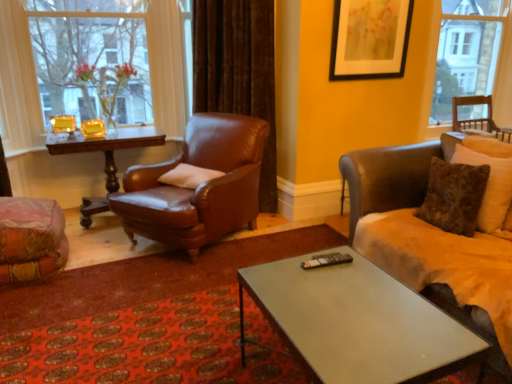
The image size is (512, 384). I want to click on wooden polished table at left, so click(x=106, y=147).

In order to face clear glass vase at upper left, the second window in the right-to-left sequence, should I rotate leftwards or rightwards?

To face it directly, rotate left by 20.698 degrees.

Image resolution: width=512 pixels, height=384 pixels. I want to click on velvet orange chair at lower left, positioned as the 1th chair in left-to-right order, so click(x=29, y=234).

Locate an element on the screen. wooden chair at right, acting as the 2th window starting from the left is located at coordinates (474, 56).

In order to click on brown velvet curtain at upper center in this screenshot , I will do `click(238, 71)`.

Locate an element on the screen. This screenshot has height=384, width=512. wooden polished table at left is located at coordinates (106, 147).

Which of these two, metallic gray coffee table at center or clear glass vase at upper left, arranged as the first window when viewed from the left, stands shorter?

Standing shorter between the two is metallic gray coffee table at center.

Is metallic gray coffee table at center positioned in front of clear glass vase at upper left, arranged as the first window when viewed from the left?

Yes, metallic gray coffee table at center is closer to the camera.

Is metallic gray coffee table at center far away from clear glass vase at upper left, the second window in the right-to-left sequence?

Indeed, metallic gray coffee table at center is not near clear glass vase at upper left, the second window in the right-to-left sequence.

In the scene shown: Could you tell me if white soft pillow at center is turned towards metallic gray coffee table at center?

No, white soft pillow at center is not aimed at metallic gray coffee table at center.

From a real-world perspective, relative to metallic gray coffee table at center, is white soft pillow at center vertically above or below?

white soft pillow at center is situated higher than metallic gray coffee table at center in the real world.

Between white soft pillow at center and metallic gray coffee table at center, which one has larger size?

Bigger between the two is metallic gray coffee table at center.

What are the coordinates of `coffee table that appears below the white soft pillow at center (from a real-world perspective)` in the screenshot? It's located at (357, 323).

From the image's perspective, would you say matte black picture frame at upper center is shown under white soft pillow at center?

Incorrect, from the image's perspective, matte black picture frame at upper center is higher than white soft pillow at center.

Does matte black picture frame at upper center contain white soft pillow at center?

Actually, white soft pillow at center is outside matte black picture frame at upper center.

Considering the positions of points (343, 59) and (193, 178), is point (343, 59) farther from camera compared to point (193, 178)?

Yes, point (343, 59) is farther from viewer.

This screenshot has width=512, height=384. In order to click on picture frame above the white soft pillow at center (from a real-world perspective) in this screenshot , I will do `click(369, 39)`.

Is brown leather couch at right, the 2th chair viewed from the right, oriented away from clear glass vase at upper left, arranged as the first window when viewed from the left?

brown leather couch at right, the 2th chair viewed from the right, is not turned away from clear glass vase at upper left, arranged as the first window when viewed from the left.

Could clear glass vase at upper left, arranged as the first window when viewed from the left, be considered to be inside brown leather couch at right, the 2th chair viewed from the right?

Definitely not — clear glass vase at upper left, arranged as the first window when viewed from the left, is not inside brown leather couch at right, the 2th chair viewed from the right.

From the image's perspective, is brown leather couch at right, which is counted as the third chair, starting from the left, on top of clear glass vase at upper left, the second window in the right-to-left sequence?

No, from the image's perspective, brown leather couch at right, which is counted as the third chair, starting from the left, is not over clear glass vase at upper left, the second window in the right-to-left sequence.

Considering the sizes of objects brown leather couch at right, which is counted as the third chair, starting from the left, and clear glass vase at upper left, the second window in the right-to-left sequence, in the image provided, who is bigger, brown leather couch at right, which is counted as the third chair, starting from the left, or clear glass vase at upper left, the second window in the right-to-left sequence,?

With larger size is brown leather couch at right, which is counted as the third chair, starting from the left.

Is point (158, 144) closer to viewer compared to point (375, 254)?

No, (158, 144) is behind (375, 254).

From the image's perspective, relative to brown leather couch at right, the 2th chair viewed from the right, is wooden polished table at left above or below?

Clearly, from the image's perspective, wooden polished table at left is above brown leather couch at right, the 2th chair viewed from the right.

From a real-world perspective, does wooden polished table at left sit lower than brown leather couch at right, which is counted as the third chair, starting from the left?

Correct, in the physical world, wooden polished table at left is lower than brown leather couch at right, which is counted as the third chair, starting from the left.

Is wooden polished table at left located outside brown leather couch at right, which is counted as the third chair, starting from the left?

Yes, wooden polished table at left is not within brown leather couch at right, which is counted as the third chair, starting from the left.

Considering the points (268, 19) and (509, 231), which point is in front, point (268, 19) or point (509, 231)?

Point (509, 231)

Is brown velvet curtain at upper center not inside brown leather couch at right, which is counted as the third chair, starting from the left?

Yes, brown velvet curtain at upper center is outside of brown leather couch at right, which is counted as the third chair, starting from the left.

Is the position of brown velvet curtain at upper center less distant than that of brown leather couch at right, the 2th chair viewed from the right?

No, brown velvet curtain at upper center is further to the viewer.

Does brown velvet curtain at upper center touch brown leather couch at right, which is counted as the third chair, starting from the left?

There is a gap between brown velvet curtain at upper center and brown leather couch at right, which is counted as the third chair, starting from the left.

Does wooden chair at right, acting as the first window starting from the right, lie in front of wooden polished table at left?

No.

Can you confirm if wooden chair at right, acting as the first window starting from the right, is smaller than wooden polished table at left?

Indeed, wooden chair at right, acting as the first window starting from the right, has a smaller size compared to wooden polished table at left.

Which is correct: wooden chair at right, acting as the first window starting from the right, is inside wooden polished table at left, or outside of it?

wooden chair at right, acting as the first window starting from the right, is outside wooden polished table at left.

Is wooden chair at right, acting as the first window starting from the right, at the right side of wooden polished table at left?

Correct, you'll find wooden chair at right, acting as the first window starting from the right, to the right of wooden polished table at left.

Locate an element on the screen. the 1st window behind the metallic gray coffee table at center is located at coordinates (18, 81).

Identify the location of pillow that appears above the metallic gray coffee table at center (from a real-world perspective). (189, 176).

Looking at the image, which one is located closer to velvet orange chair at lower left, positioned as the 1th chair in left-to-right order, black plastic remote control at center or brown leather chair at center, which ranks as the second chair in left-to-right order?

Among the two, brown leather chair at center, which ranks as the second chair in left-to-right order, is located nearer to velvet orange chair at lower left, positioned as the 1th chair in left-to-right order.

From the image, which object appears to be nearer to velvet orange chair at lower left, positioned as the 1th chair in left-to-right order, brown leather couch at right, which is counted as the third chair, starting from the left, or wooden chair at right, positioned as the fourth chair in left-to-right order?

brown leather couch at right, which is counted as the third chair, starting from the left, is positioned closer to the anchor velvet orange chair at lower left, positioned as the 1th chair in left-to-right order.

Considering their positions, is brown leather chair at center, which ranks as the second chair in left-to-right order, positioned closer to velvet orange chair at lower left, the 4th chair when ordered from right to left, than matte black picture frame at upper center?

Among the two, brown leather chair at center, which ranks as the second chair in left-to-right order, is located nearer to velvet orange chair at lower left, the 4th chair when ordered from right to left.

Based on their spatial positions, is clear glass vase at upper left, the second window in the right-to-left sequence, or white soft pillow at center further from brown leather chair at center, which ranks as the second chair in left-to-right order?

clear glass vase at upper left, the second window in the right-to-left sequence.

Considering their positions, is velvet orange chair at lower left, positioned as the 1th chair in left-to-right order, positioned closer to brown leather couch at right, which is counted as the third chair, starting from the left, than clear glass vase at upper left, arranged as the first window when viewed from the left?

velvet orange chair at lower left, positioned as the 1th chair in left-to-right order, is closer to brown leather couch at right, which is counted as the third chair, starting from the left.

Looking at the image, which one is located further to brown leather chair at center, which ranks as the second chair in left-to-right order, white soft pillow at center or wooden chair at right, acting as the 2th window starting from the left?

Based on the image, wooden chair at right, acting as the 2th window starting from the left, appears to be further to brown leather chair at center, which ranks as the second chair in left-to-right order.

Which object lies nearer to the anchor point brown leather chair at center, the 3th chair viewed from the right, matte black picture frame at upper center or metallic gray coffee table at center?

matte black picture frame at upper center is closer to brown leather chair at center, the 3th chair viewed from the right.

When comparing their distances from metallic gray coffee table at center, does wooden chair at right, positioned as the fourth chair in left-to-right order, or matte black picture frame at upper center seem closer?

Based on the image, matte black picture frame at upper center appears to be nearer to metallic gray coffee table at center.

Find the location of `chair between velvet orange chair at lower left, positioned as the 1th chair in left-to-right order, and black plastic remote control at center, in the horizontal direction`. chair between velvet orange chair at lower left, positioned as the 1th chair in left-to-right order, and black plastic remote control at center, in the horizontal direction is located at coordinates (199, 186).

Find the location of a particular element. Image resolution: width=512 pixels, height=384 pixels. coffee table located between black plastic remote control at center and brown leather couch at right, the 2th chair viewed from the right, in the left-right direction is located at coordinates (357, 323).

Where is `remote control between brown leather couch at right, which is counted as the third chair, starting from the left, and matte black picture frame at upper center in the front-back direction`? The width and height of the screenshot is (512, 384). remote control between brown leather couch at right, which is counted as the third chair, starting from the left, and matte black picture frame at upper center in the front-back direction is located at coordinates (326, 260).

This screenshot has height=384, width=512. I want to click on curtain located between brown leather chair at center, which ranks as the second chair in left-to-right order, and brown leather couch at right, which is counted as the third chair, starting from the left, in the left-right direction, so click(238, 71).